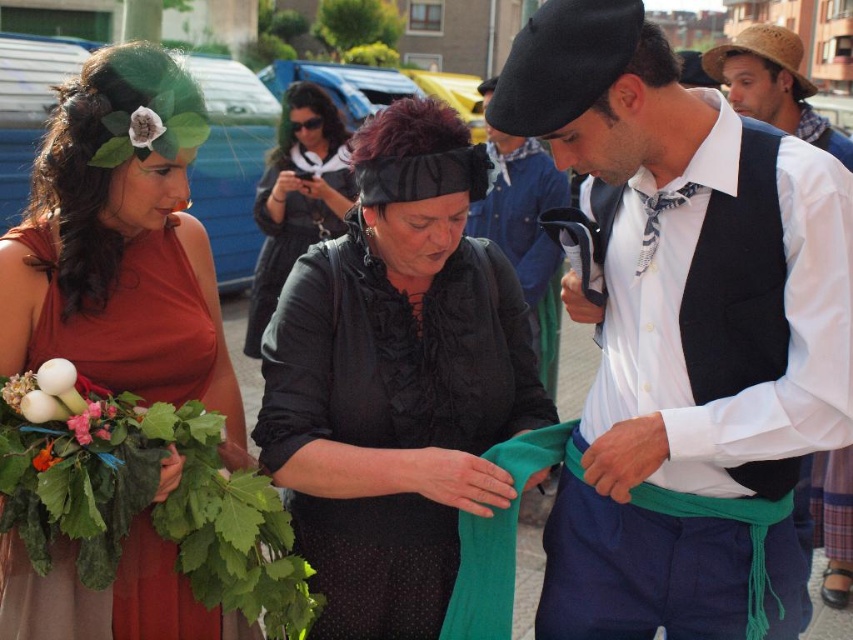
Question: Which object is farther from the camera taking this photo?

Choices:
 (A) black satin blouse at center
 (B) matte red dress at left
 (C) fuzzy white flower at upper left
 (D) matte black vest at center

Answer: (A)

Question: Which point is farther from the camera taking this photo?

Choices:
 (A) (548, 168)
 (B) (833, 500)
 (C) (251, 310)
 (D) (788, 68)

Answer: (C)

Question: Observing the image, what is the correct spatial positioning of white shirt with black vest at center in reference to matte black hat at center?

Choices:
 (A) left
 (B) right

Answer: (B)

Question: Among these objects, which one is nearest to the camera?

Choices:
 (A) straw hat at upper right
 (B) matte black vest at center
 (C) green leafy bouquet at lower left
 (D) rustic straw hat at upper right

Answer: (C)

Question: Does matte black vest at center have a larger size compared to matte red dress at left?

Choices:
 (A) yes
 (B) no

Answer: (A)

Question: Can you confirm if matte black hat at center is thinner than green leafy plant at lower left?

Choices:
 (A) yes
 (B) no

Answer: (B)